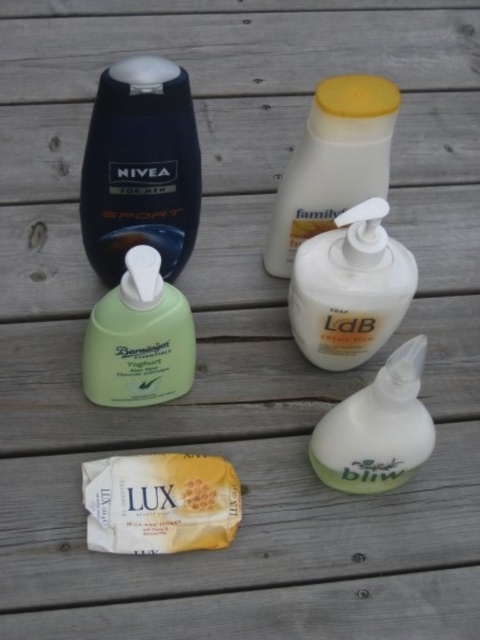
Looking at this image, you are a delivery person who needs to place a new matte black bottle at upper left onto the wooden surface without moving any existing items. The new bottle is 12 inches in diameter. Can you fit it between the existing items?

The existing items are 35.93 inches apart, so there is sufficient space to fit a 12 inch diameter matte black bottle at upper left between them.

You are organizing a bathroom shelf and need to place the yellow matte soap bar at lower center and the white matte squeeze bottle at lower right. According to their arrangement in the image, which one should you place on the left side of the other?

The yellow matte soap bar at lower center should be placed on the left side of the white matte squeeze bottle at lower right because the yellow matte soap bar at lower center is positioned on the left side of white matte squeeze bottle at lower right in the image.